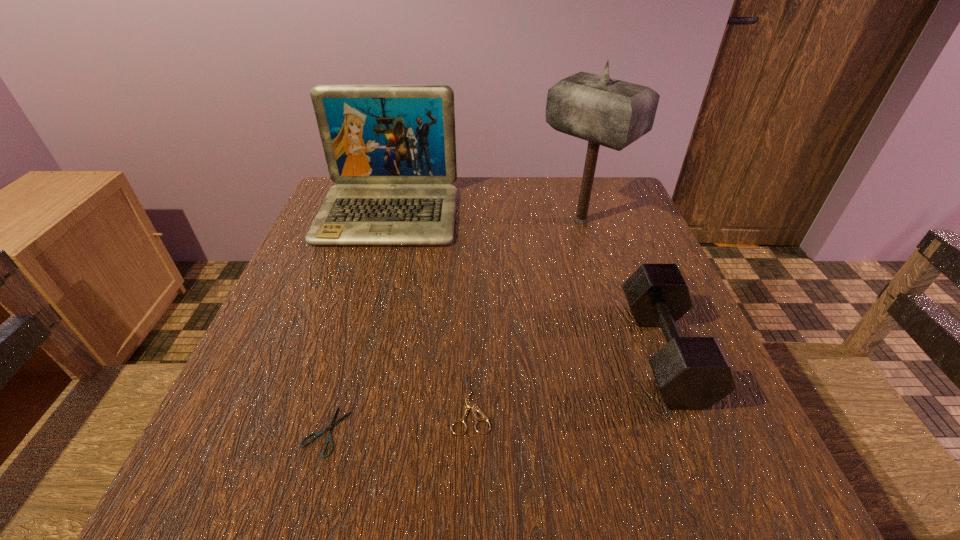
The height and width of the screenshot is (540, 960). I want to click on mallet, so click(604, 111).

The height and width of the screenshot is (540, 960). I want to click on laptop computer, so click(x=391, y=149).

The width and height of the screenshot is (960, 540). What are the coordinates of `dumbbell` in the screenshot? It's located at (692, 373).

Locate an element on the screen. the right shears is located at coordinates (468, 404).

This screenshot has width=960, height=540. I want to click on the fourth tallest object, so click(x=468, y=404).

Image resolution: width=960 pixels, height=540 pixels. What are the coordinates of `the shortest object` in the screenshot? It's located at [x=330, y=428].

You are a GUI agent. You are given a task and a screenshot of the screen. Output one action in this format:
    pyautogui.click(x=<x>, y=<y>)
    Task: Click on the shorter shears
    The width and height of the screenshot is (960, 540).
    Given the screenshot: What is the action you would take?
    pyautogui.click(x=330, y=428)

You are a GUI agent. You are given a task and a screenshot of the screen. Output one action in this format:
    pyautogui.click(x=<x>, y=<y>)
    Task: Click on the free region located 0.340m on the left of the mallet
    Image resolution: width=960 pixels, height=540 pixels.
    Given the screenshot: What is the action you would take?
    pyautogui.click(x=397, y=221)

Locate an element on the screen. free space located 0.310m on the screen of the laptop computer is located at coordinates (348, 356).

Locate an element on the screen. This screenshot has width=960, height=540. vacant space located on the left of the dumbbell is located at coordinates (546, 352).